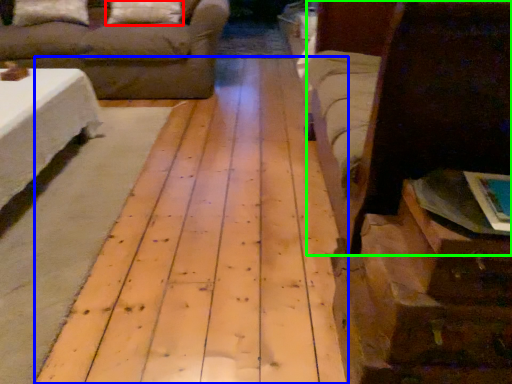
Question: Which object is positioned closest to pillow (highlighted by a red box)? Select from plywood (highlighted by a blue box) and bed (highlighted by a green box).

Choices:
 (A) plywood
 (B) bed

Answer: (A)